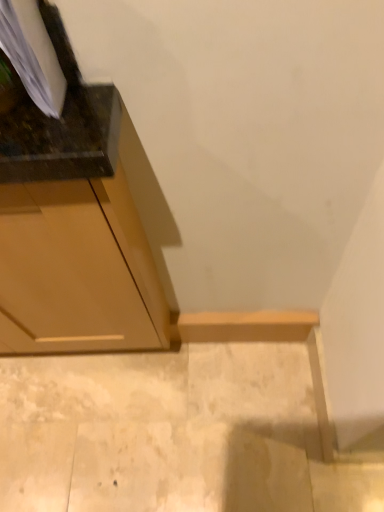
The height and width of the screenshot is (512, 384). What do you see at coordinates (77, 270) in the screenshot?
I see `matte brown cabinet at left` at bounding box center [77, 270].

In order to face matte brown cabinet at left, should I rotate leftwards or rightwards?

You should look left and rotate roughly 20.981 degrees.

At what (x,y) coordinates should I click in order to perform the action: click on matte brown cabinet at left. Please return your answer as a coordinate pair (x, y). The image size is (384, 512). Looking at the image, I should click on (77, 270).

The image size is (384, 512). In order to click on matte brown cabinet at left in this screenshot , I will do `click(77, 270)`.